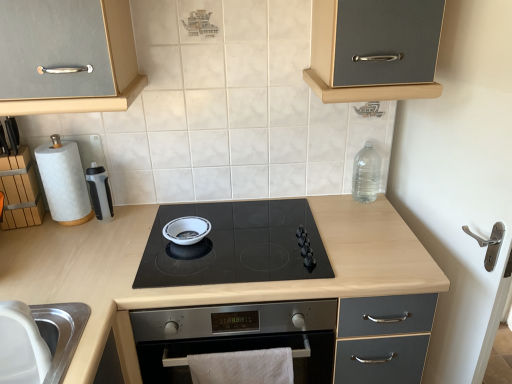
What are the coordinates of `free space in front of clear plastic bottle at upper right` in the screenshot? It's located at click(x=366, y=221).